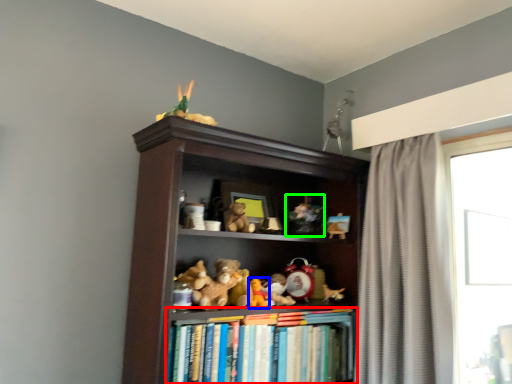
Question: Estimate the real-world distances between objects in this image. Which object is closer to book (highlighted by a red box), toy (highlighted by a blue box) or toy (highlighted by a green box)?

Choices:
 (A) toy
 (B) toy

Answer: (A)